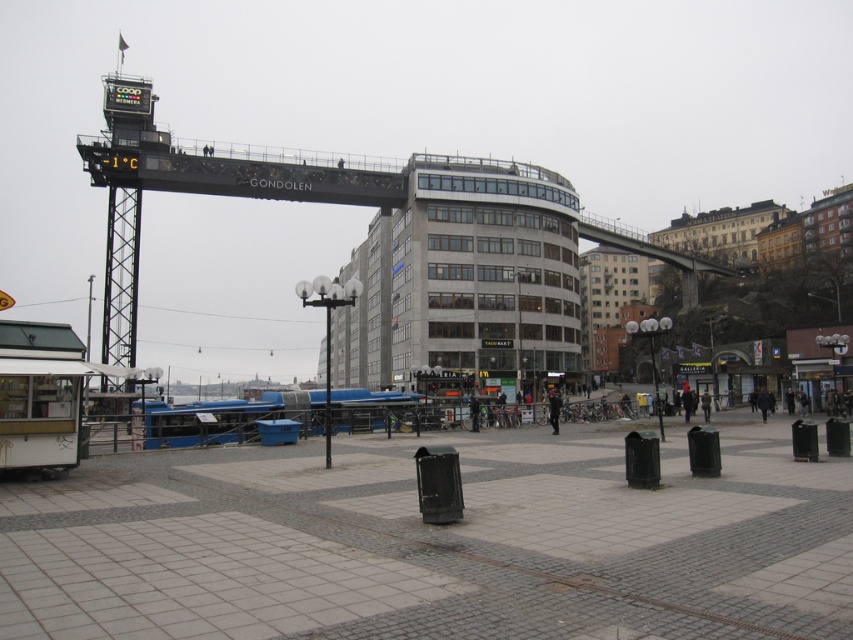
Question: Which point appears closest to the camera in this image?

Choices:
 (A) pos(711,401)
 (B) pos(328,403)
 (C) pos(550,422)

Answer: (B)

Question: Is dark blue jacket at center bigger than dark gray jacket at center?

Choices:
 (A) yes
 (B) no

Answer: (A)

Question: Among these points, which one is nearest to the camera?

Choices:
 (A) (704, 403)
 (B) (326, 452)
 (C) (556, 401)

Answer: (B)

Question: Can you confirm if metallic pole at center is smaller than dark blue jacket at center?

Choices:
 (A) yes
 (B) no

Answer: (B)

Question: Does dark blue jacket at center lie behind dark gray jacket at center?

Choices:
 (A) no
 (B) yes

Answer: (A)

Question: Among these points, which one is farthest from the camera?

Choices:
 (A) pyautogui.click(x=554, y=426)
 (B) pyautogui.click(x=326, y=358)

Answer: (B)